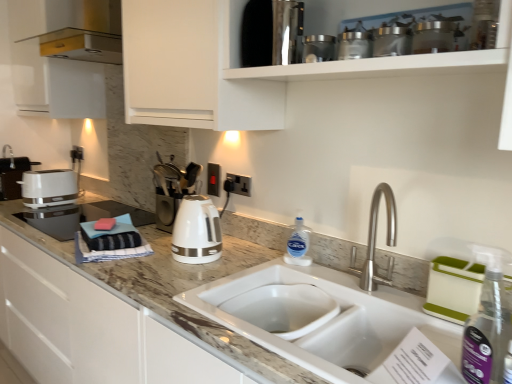
Where is `free spot in front of white glossy toaster at left`? free spot in front of white glossy toaster at left is located at coordinates (30, 213).